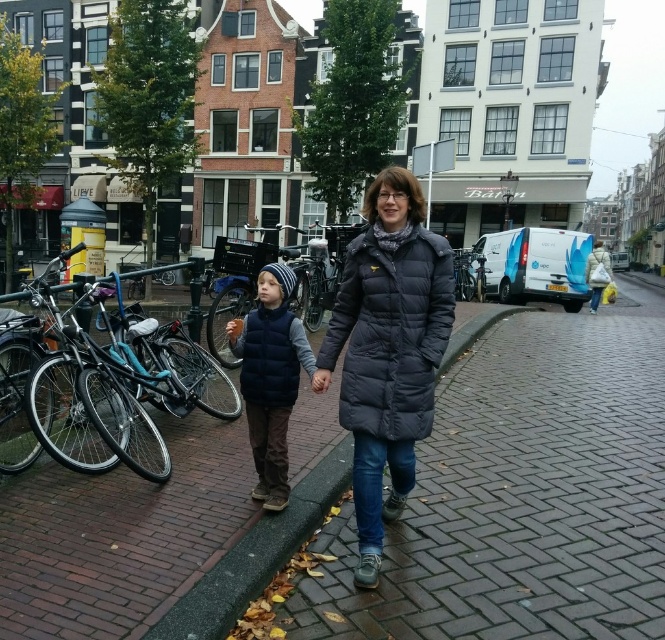
You are a delivery person who needs to carry a package in your backpack. You are standing between the shiny blue bicycle at left and the navy puffer coat at center. Which object is wider so you can choose the side with more space to walk?

The shiny blue bicycle at left is wider than the navy puffer coat at center, so you should choose the side of the navy puffer coat at center to walk as there is more space.

You are a delivery person who needs to place a small package between the navy puffer coat at center and the brick at center. Given that the package is 3 feet long, will it fit in the space between them?

The navy puffer coat at center is 3.68 feet away from the brick at center, so the 3 feet long package will fit in the space between them since it is shorter than the distance between the two objects.